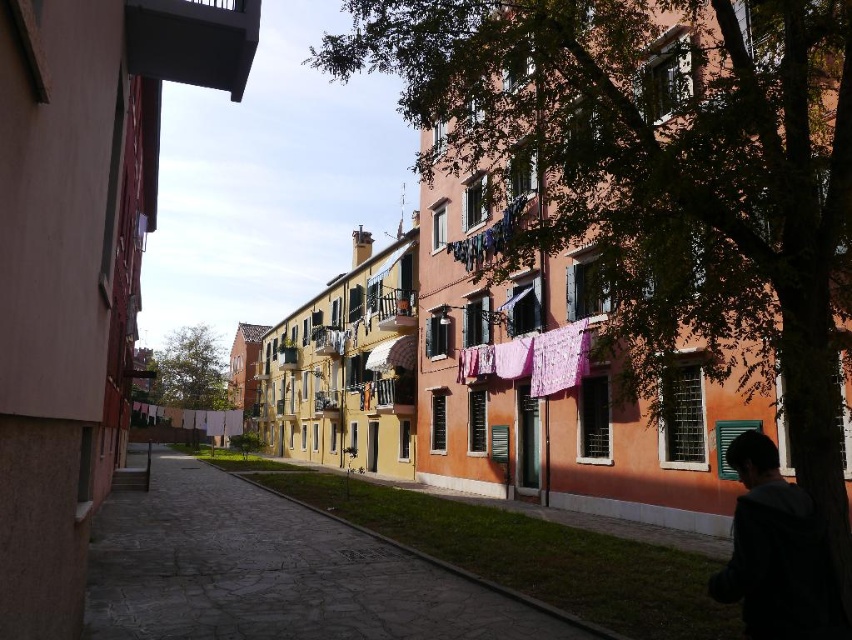
Question: Which object is closer to the camera taking this photo?

Choices:
 (A) paved stone alley at center
 (B) pink fabric clothesline at upper center

Answer: (A)

Question: Can you confirm if paved stone alley at center is wider than dark gray jacket at lower right?

Choices:
 (A) yes
 (B) no

Answer: (A)

Question: Which object is positioned farthest from the paved stone alley at center?

Choices:
 (A) dark gray jacket at lower right
 (B) pink fabric clothesline at upper center

Answer: (A)

Question: Which point is closer to the camera taking this photo?

Choices:
 (A) (473, 234)
 (B) (749, 556)
 (C) (245, 616)

Answer: (B)

Question: In this image, where is paved stone alley at center located relative to dark gray jacket at lower right?

Choices:
 (A) right
 (B) left

Answer: (B)

Question: Observing the image, what is the correct spatial positioning of dark gray jacket at lower right in reference to pink fabric clothesline at upper center?

Choices:
 (A) above
 (B) below

Answer: (B)